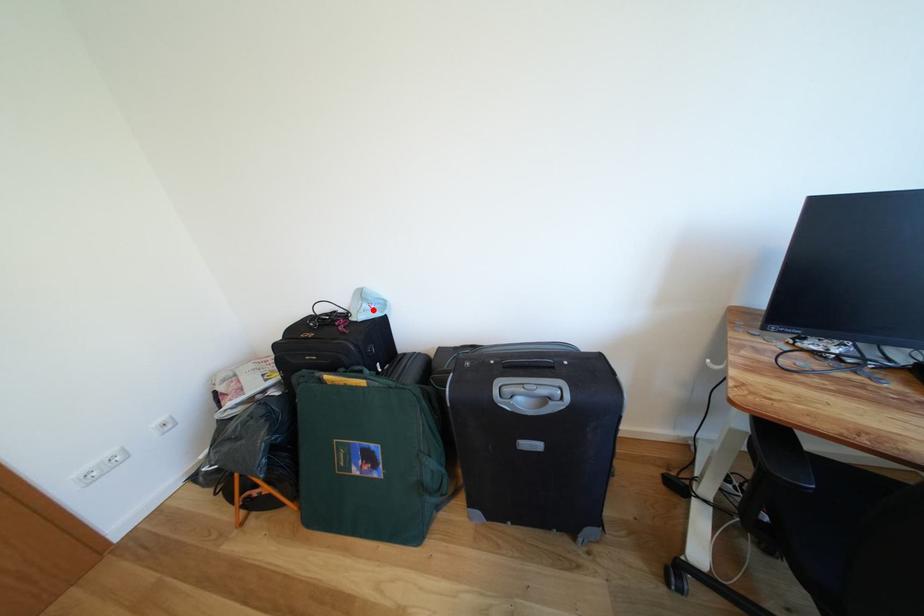
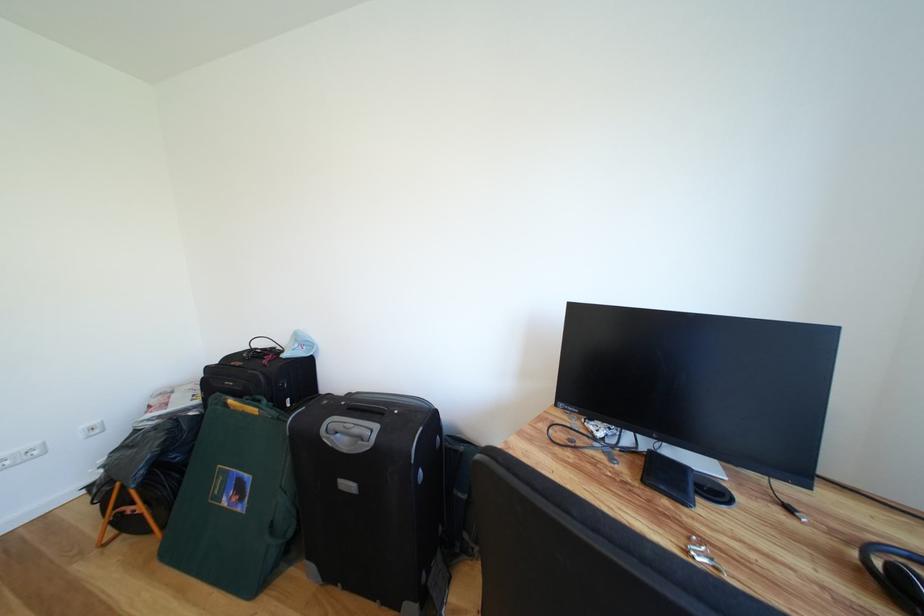
The point at the highlighted location is marked in the first image. Where is the corresponding point in the second image?

(305, 350)